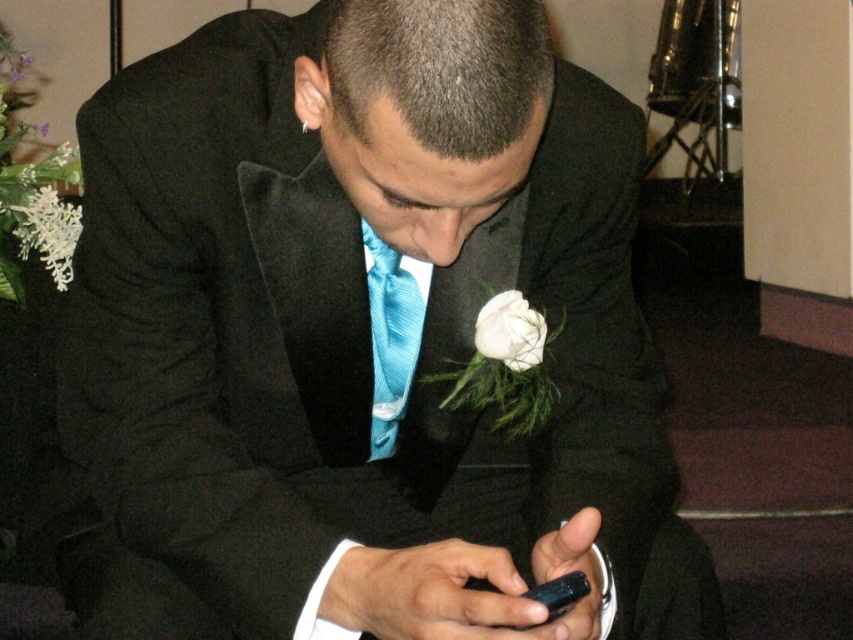
Question: Is white fluffy flower at left above white silk flower at center?

Choices:
 (A) yes
 (B) no

Answer: (A)

Question: Which point appears closest to the camera in this image?

Choices:
 (A) (395, 442)
 (B) (57, 285)
 (C) (41, 125)
 (D) (474, 340)

Answer: (D)

Question: Observing the image, what is the correct spatial positioning of blue striped tie at center in reference to white matte flower at upper left?

Choices:
 (A) right
 (B) left

Answer: (A)

Question: Which object is positioned farthest from the white matte flower at upper left?

Choices:
 (A) white fluffy flower at left
 (B) blue striped tie at center
 (C) white silk flower at center

Answer: (C)

Question: Which of these objects is positioned closest to the white matte flower at upper left?

Choices:
 (A) white fluffy flower at left
 (B) white silk flower at center
 (C) blue striped tie at center

Answer: (A)

Question: Can you confirm if blue striped tie at center is positioned to the right of white matte flower at upper left?

Choices:
 (A) no
 (B) yes

Answer: (B)